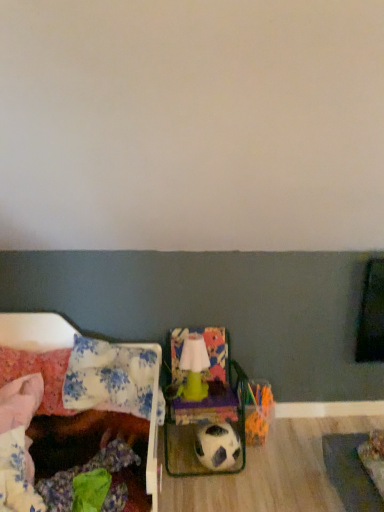
Question: Does black and white textured football at center have a greater width compared to green matte lamp at center?

Choices:
 (A) no
 (B) yes

Answer: (B)

Question: Could green matte lamp at center be considered to be inside black and white textured football at center?

Choices:
 (A) no
 (B) yes

Answer: (A)

Question: Could you tell me if black and white textured football at center is facing green matte lamp at center?

Choices:
 (A) yes
 (B) no

Answer: (B)

Question: Would you say black and white textured football at center is outside green matte lamp at center?

Choices:
 (A) no
 (B) yes

Answer: (B)

Question: Are black and white textured football at center and green matte lamp at center beside each other?

Choices:
 (A) yes
 (B) no

Answer: (B)

Question: Can you confirm if black and white textured football at center is shorter than green matte lamp at center?

Choices:
 (A) no
 (B) yes

Answer: (B)

Question: Can you confirm if black and white textured football at center is positioned to the right of fluffy pink pillow at left, the first pillow viewed from the left?

Choices:
 (A) yes
 (B) no

Answer: (A)

Question: Is black and white textured football at center thinner than fluffy pink pillow at left, positioned as the second pillow in right-to-left order?

Choices:
 (A) no
 (B) yes

Answer: (B)

Question: From a real-world perspective, is black and white textured football at center physically above fluffy pink pillow at left, the first pillow viewed from the left?

Choices:
 (A) yes
 (B) no

Answer: (B)

Question: From the image's perspective, would you say black and white textured football at center is shown under fluffy pink pillow at left, positioned as the second pillow in right-to-left order?

Choices:
 (A) yes
 (B) no

Answer: (A)

Question: Considering the relative sizes of black and white textured football at center and fluffy pink pillow at left, the first pillow viewed from the left, in the image provided, is black and white textured football at center taller than fluffy pink pillow at left, the first pillow viewed from the left,?

Choices:
 (A) yes
 (B) no

Answer: (B)

Question: Considering the relative sizes of black and white textured football at center and fluffy pink pillow at left, positioned as the second pillow in right-to-left order, in the image provided, is black and white textured football at center bigger than fluffy pink pillow at left, positioned as the second pillow in right-to-left order,?

Choices:
 (A) no
 (B) yes

Answer: (A)

Question: Is floral fabric pillow at left, which is the first pillow in right-to-left order, closer to the viewer compared to matte green armchair at center?

Choices:
 (A) no
 (B) yes

Answer: (B)